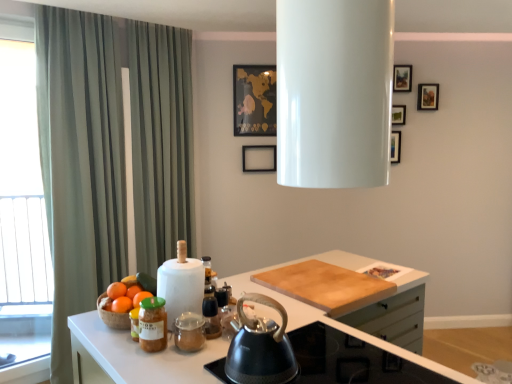
Question: From the image's perspective, is matte glass jar at lower left positioned above or below white sheer curtain at left?

Choices:
 (A) above
 (B) below

Answer: (B)

Question: Considering the positions of matte glass jar at lower left and white sheer curtain at left in the image, is matte glass jar at lower left wider or thinner than white sheer curtain at left?

Choices:
 (A) thin
 (B) wide

Answer: (B)

Question: Based on their relative distances, which object is nearer to the orangesmoothfruit at left, which is the first orange from left to right?

Choices:
 (A) black matte picture frame at center, which is the 3th picture frame in right-to-left order
 (B) gold paper map at upper center, marked as the fourth picture frame in a right-to-left arrangement
 (C) white glossy range hood at upper center, the 1th appliance viewed from the front
 (D) orange matte at left
 (E) green striped curtain at left

Answer: (D)

Question: Based on their relative distances, which object is farther from the black matte picture frame at center, which is the 3th picture frame in right-to-left order?

Choices:
 (A) black matte kettle at center
 (B) green striped curtain at left
 (C) orange matte at left
 (D) white paper towel at center, the second appliance viewed from the top
 (E) white glossy range hood at upper center, the 2th appliance positioned from the back

Answer: (E)